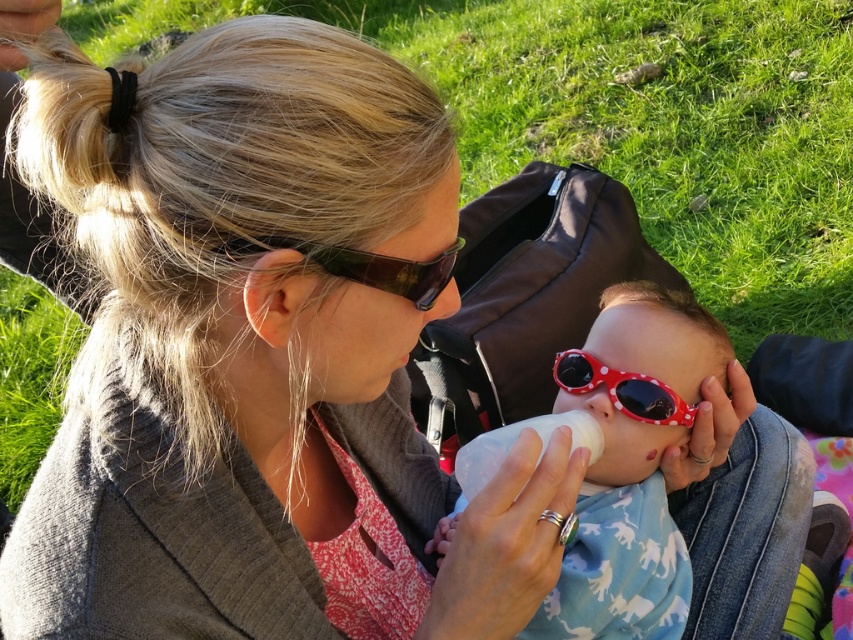
Does point (421, 308) lie in front of point (583, 392)?

Yes, it is in front of point (583, 392).

Does black plastic goggles at upper center have a lesser height compared to polka dot plastic goggles at center?

Indeed, black plastic goggles at upper center has a lesser height compared to polka dot plastic goggles at center.

The width and height of the screenshot is (853, 640). What do you see at coordinates (366, 266) in the screenshot? I see `black plastic goggles at upper center` at bounding box center [366, 266].

Identify the location of black plastic goggles at upper center. (366, 266).

Who is shorter, black plastic goggles at upper center or white plastic bottle at center?

black plastic goggles at upper center

Which is in front, point (395, 291) or point (488, 449)?

Point (395, 291)

Is point (422, 307) positioned before point (508, 444)?

Yes, point (422, 307) is closer to viewer.

You are a GUI agent. You are given a task and a screenshot of the screen. Output one action in this format:
    pyautogui.click(x=<x>, y=<y>)
    Task: Click on the black plastic goggles at upper center
    
    Given the screenshot: What is the action you would take?
    pyautogui.click(x=366, y=266)

Who is taller, polka dot plastic sunglasses at center or black plastic goggles at upper center?

Standing taller between the two is polka dot plastic sunglasses at center.

This screenshot has width=853, height=640. What do you see at coordinates (631, 461) in the screenshot? I see `polka dot plastic sunglasses at center` at bounding box center [631, 461].

The image size is (853, 640). What do you see at coordinates (631, 461) in the screenshot?
I see `polka dot plastic sunglasses at center` at bounding box center [631, 461].

What are the coordinates of `polka dot plastic sunglasses at center` in the screenshot? It's located at (631, 461).